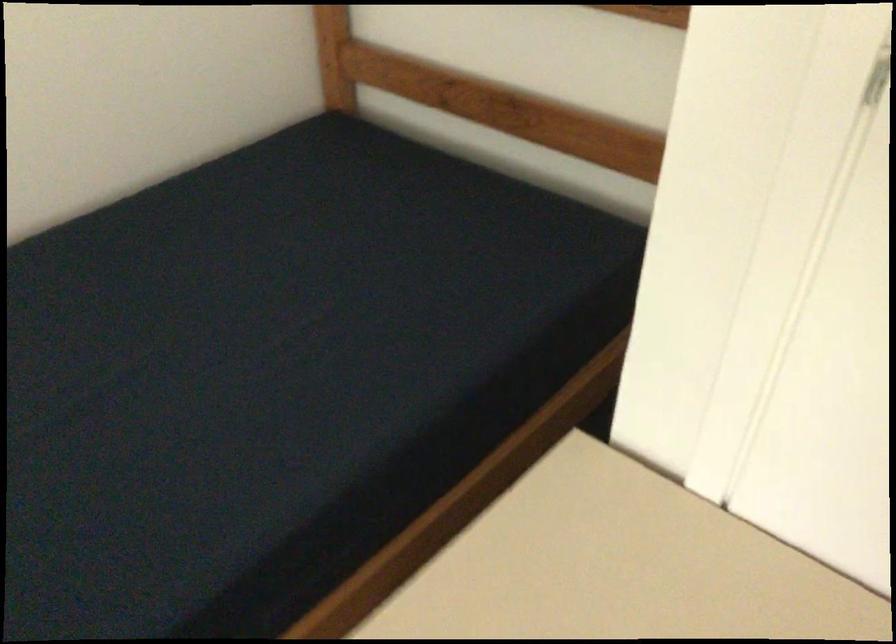
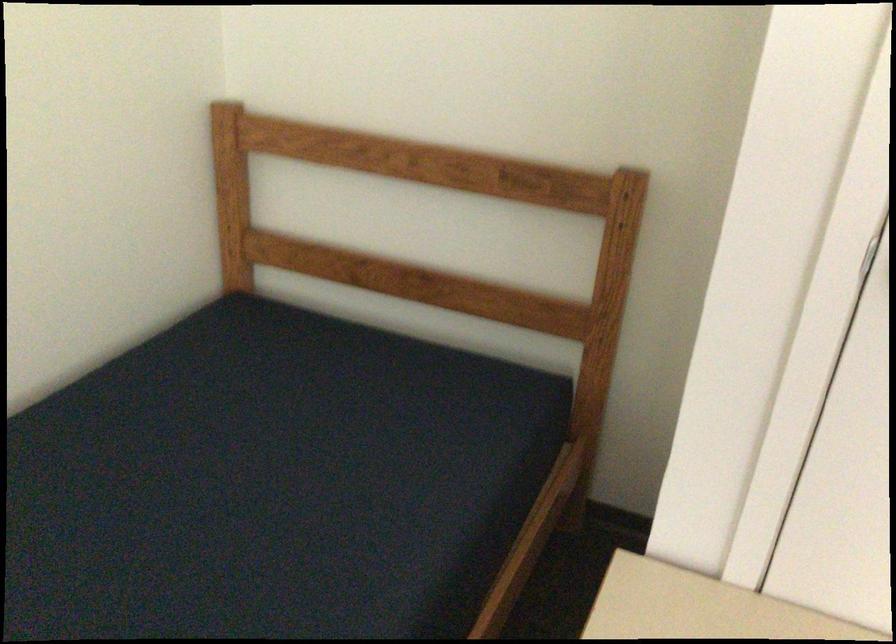
Where in the second image is the point corresponding to (506,106) from the first image?

(419, 285)